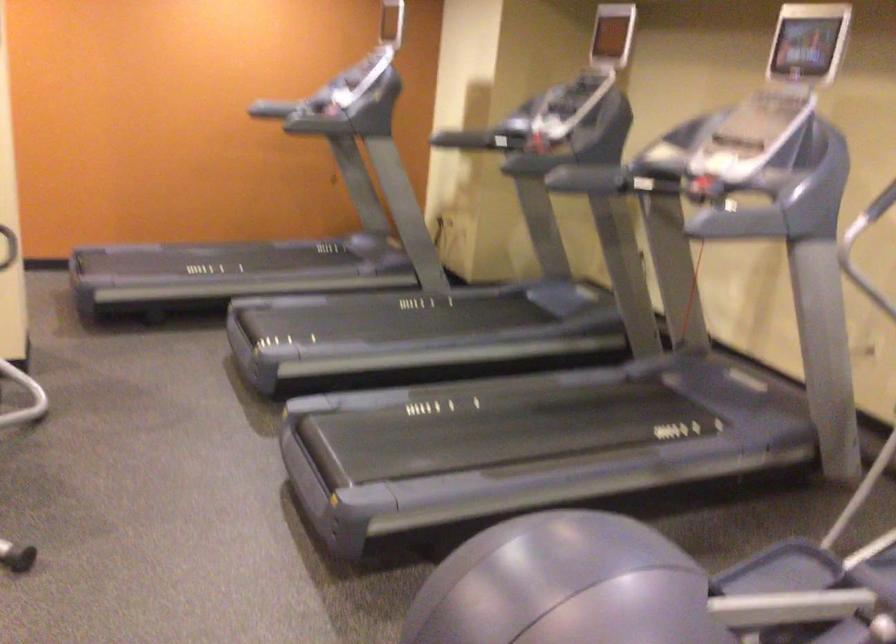
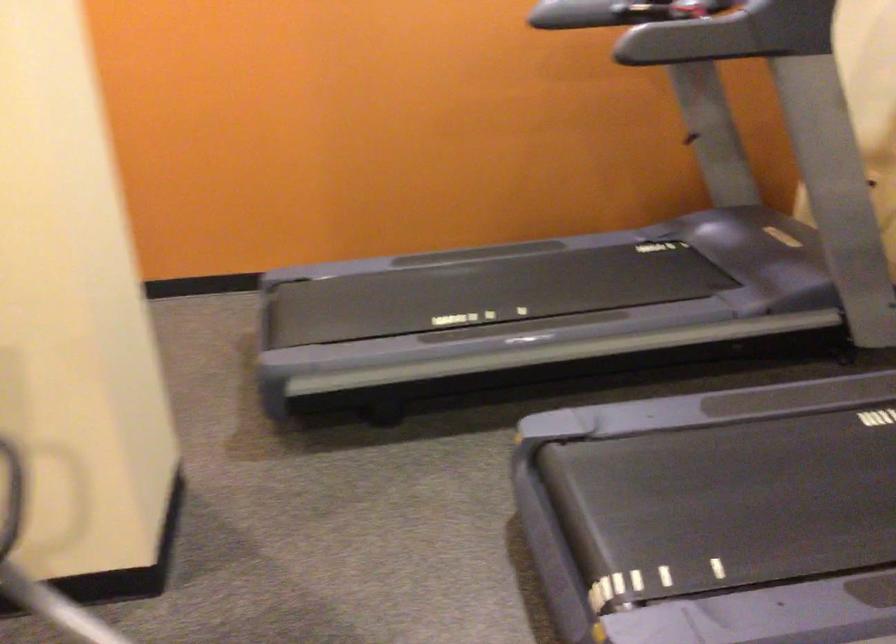
Question: In a continuous first-person perspective shot, in which direction is the camera moving?

Choices:
 (A) Left
 (B) Right
 (C) Forward
 (D) Backward

Answer: (C)